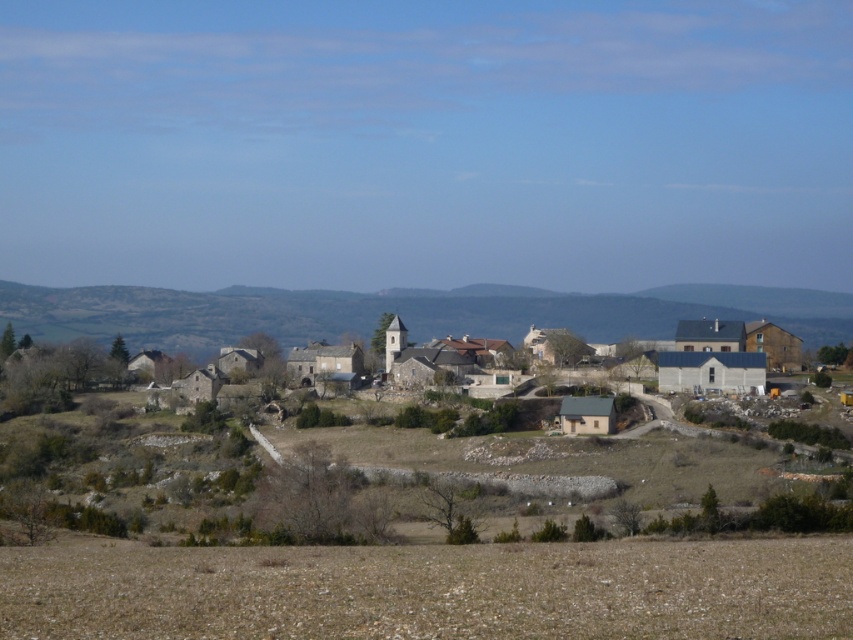
Question: Which point appears farthest from the camera in this image?

Choices:
 (A) (596, 572)
 (B) (500, 378)

Answer: (B)

Question: Does brown grassland at lower center appear under stone houses at center?

Choices:
 (A) yes
 (B) no

Answer: (A)

Question: Which point is closer to the camera taking this photo?

Choices:
 (A) (393, 563)
 (B) (432, 369)

Answer: (A)

Question: Is brown grassland at lower center below stone houses at center?

Choices:
 (A) no
 (B) yes

Answer: (B)

Question: Can you confirm if brown grassland at lower center is wider than stone houses at center?

Choices:
 (A) no
 (B) yes

Answer: (A)

Question: Which point is farther from the camera taking this photo?

Choices:
 (A) (720, 604)
 (B) (648, 340)

Answer: (B)